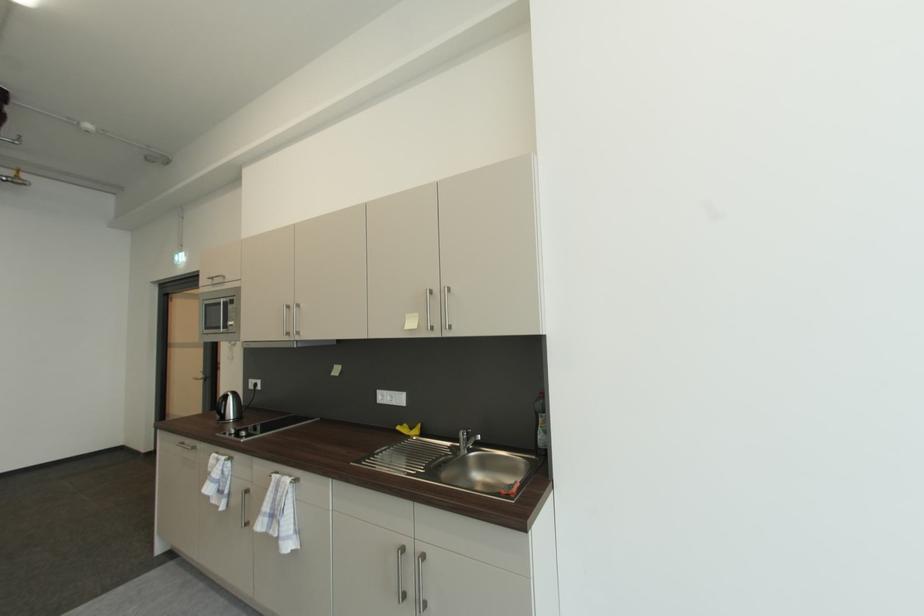
Where is `faucet handle`? This screenshot has width=924, height=616. faucet handle is located at coordinates (466, 440).